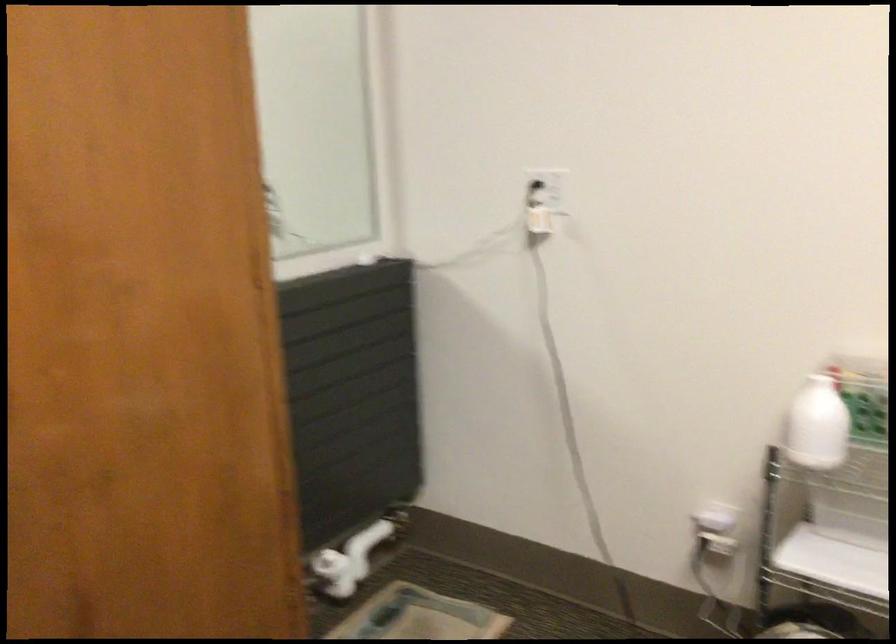
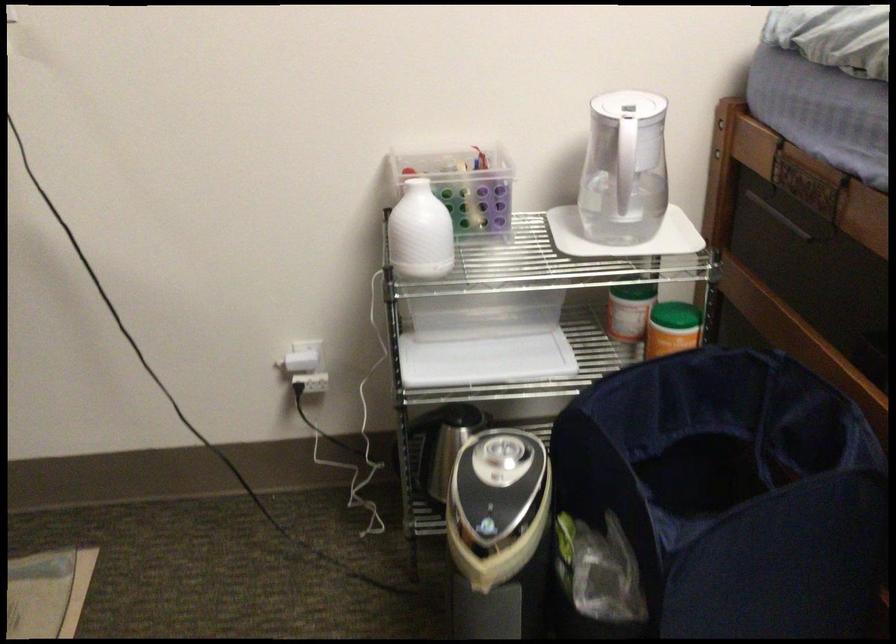
The point at [815,427] is marked in the first image. Where is the corresponding point in the second image?

(419, 232)